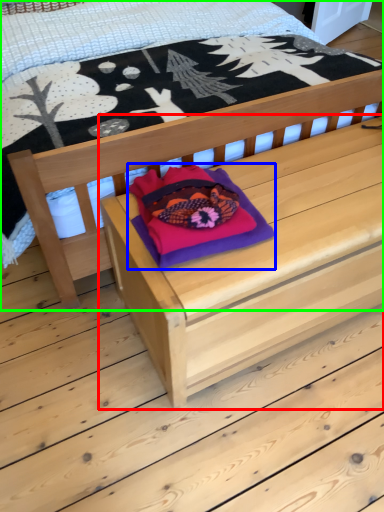
Question: Which object is the farthest from table (highlighted by a red box)? Choose among these: throw pillow (highlighted by a blue box) or bed (highlighted by a green box).

Choices:
 (A) throw pillow
 (B) bed

Answer: (B)